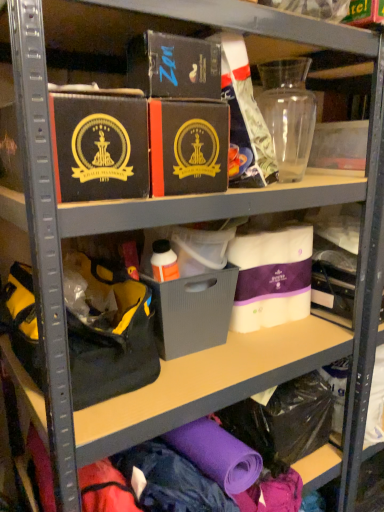
Measure the distance between white fabric quilted mattress at center, which is counted as the 4th box, starting from the left, and camera.

A distance of 3.96 feet exists between white fabric quilted mattress at center, which is counted as the 4th box, starting from the left, and camera.

What do you see at coordinates (191, 310) in the screenshot?
I see `gray matte storage box at center` at bounding box center [191, 310].

Measure the distance between point (169, 89) and camera.

76.50 centimeters.

The height and width of the screenshot is (512, 384). What are the coordinates of `matte black box at upper left, positioned as the 1th box in left-to-right order` in the screenshot? It's located at (99, 146).

From a real-world perspective, is gray matte storage box at center positioned above or below matte black box at center, the 3th box viewed from the right?

From a real-world perspective, gray matte storage box at center is physically below matte black box at center, the 3th box viewed from the right.

Is point (215, 290) closer or farther from the camera than point (171, 101)?

Point (215, 290) is positioned farther from the camera compared to point (171, 101).

How distant is gray matte storage box at center from matte black box at center, the second box in the left-to-right sequence?

gray matte storage box at center is 15.00 inches from matte black box at center, the second box in the left-to-right sequence.

Can you confirm if gray matte storage box at center is wider than matte black box at center, the 3th box viewed from the right?

Yes, gray matte storage box at center is wider than matte black box at center, the 3th box viewed from the right.

Which object is closer to the camera taking this photo, white fabric quilted mattress at center, which is counted as the 4th box, starting from the left, or matte black box at center, the 3th box viewed from the right?

matte black box at center, the 3th box viewed from the right, is closer to the camera.

Looking at this image, which is more to the left, white fabric quilted mattress at center, which is counted as the 4th box, starting from the left, or matte black box at center, the 3th box viewed from the right?

From the viewer's perspective, matte black box at center, the 3th box viewed from the right, appears more on the left side.

How different are the orientations of white fabric quilted mattress at center, the first box when ordered from right to left, and matte black box at center, the second box in the left-to-right sequence, in degrees?

The facing directions of white fabric quilted mattress at center, the first box when ordered from right to left, and matte black box at center, the second box in the left-to-right sequence, are 0.584 degrees apart.

Could you tell me if black fabric handbag at left is turned towards white fabric quilted mattress at center, which is counted as the 4th box, starting from the left?

No, black fabric handbag at left is not facing towards white fabric quilted mattress at center, which is counted as the 4th box, starting from the left.

Can you confirm if black fabric handbag at left is thinner than white fabric quilted mattress at center, the first box when ordered from right to left?

In fact, black fabric handbag at left might be wider than white fabric quilted mattress at center, the first box when ordered from right to left.

Is the surface of black fabric handbag at left in direct contact with white fabric quilted mattress at center, the first box when ordered from right to left?

No, black fabric handbag at left is not touching white fabric quilted mattress at center, the first box when ordered from right to left.

Is point (27, 369) positioned behind point (260, 247)?

No, (27, 369) is in front of (260, 247).

Can we say matte black box at upper left, which ranks as the fourth box in right-to-left order, lies outside matte black box at center, the second box in the left-to-right sequence?

Absolutely, matte black box at upper left, which ranks as the fourth box in right-to-left order, is external to matte black box at center, the second box in the left-to-right sequence.

Which is in front, matte black box at upper left, positioned as the 1th box in left-to-right order, or matte black box at center, the 3th box viewed from the right?

matte black box at upper left, positioned as the 1th box in left-to-right order, is in front.

Between matte black box at upper left, positioned as the 1th box in left-to-right order, and matte black box at center, the 3th box viewed from the right, which one has larger size?

matte black box at upper left, positioned as the 1th box in left-to-right order.

Which of these two, matte black box at upper center, which is the second box from right to left, or white fabric quilted mattress at center, the first box when ordered from right to left, is wider?

Wider between the two is matte black box at upper center, which is the second box from right to left.

Can you confirm if matte black box at upper center, which is the second box from right to left, is taller than white fabric quilted mattress at center, the first box when ordered from right to left?

No.

How many degrees apart are the facing directions of matte black box at upper center, which is counted as the third box, starting from the left, and white fabric quilted mattress at center, which is counted as the 4th box, starting from the left?

matte black box at upper center, which is counted as the third box, starting from the left, and white fabric quilted mattress at center, which is counted as the 4th box, starting from the left, are facing 0.0541 degrees away from each other.

Would you say matte black box at upper center, which is the second box from right to left, is inside or outside white fabric quilted mattress at center, the first box when ordered from right to left?

matte black box at upper center, which is the second box from right to left, is not enclosed by white fabric quilted mattress at center, the first box when ordered from right to left.

Is matte black box at center, the second box in the left-to-right sequence, not inside gray matte storage box at center?

Yes.

Considering the points (171, 149) and (183, 351), which point is in front, point (171, 149) or point (183, 351)?

Point (171, 149)

From the image's perspective, is matte black box at center, the 3th box viewed from the right, above or below gray matte storage box at center?

Based on their image positions, matte black box at center, the 3th box viewed from the right, is located above gray matte storage box at center.

Consider the image. Is white fabric quilted mattress at center, the first box when ordered from right to left, looking in the opposite direction of black fabric handbag at left?

No, white fabric quilted mattress at center, the first box when ordered from right to left,'s orientation is not away from black fabric handbag at left.

Is white fabric quilted mattress at center, which is counted as the 4th box, starting from the left, to the left of black fabric handbag at left from the viewer's perspective?

In fact, white fabric quilted mattress at center, which is counted as the 4th box, starting from the left, is to the right of black fabric handbag at left.

How different are the orientations of white fabric quilted mattress at center, which is counted as the 4th box, starting from the left, and black fabric handbag at left in degrees?

The angle between the facing direction of white fabric quilted mattress at center, which is counted as the 4th box, starting from the left, and the facing direction of black fabric handbag at left is 0.231 degrees.

Can you confirm if white fabric quilted mattress at center, which is counted as the 4th box, starting from the left, is shorter than black fabric handbag at left?

In fact, white fabric quilted mattress at center, which is counted as the 4th box, starting from the left, may be taller than black fabric handbag at left.

Find the location of `storage box that appears below the matte black box at center, the second box in the left-to-right sequence (from a real-world perspective)`. storage box that appears below the matte black box at center, the second box in the left-to-right sequence (from a real-world perspective) is located at coordinates click(x=191, y=310).

What are the coordinates of `box that is below the matte black box at center, the 3th box viewed from the right (from the image's perspective)` in the screenshot? It's located at (271, 277).

Which object lies further to the anchor point gray matte storage box at center, matte black box at upper left, positioned as the 1th box in left-to-right order, or black fabric handbag at left?

matte black box at upper left, positioned as the 1th box in left-to-right order, lies further to gray matte storage box at center than the other object.

Considering their positions, is white fabric quilted mattress at center, which is counted as the 4th box, starting from the left, positioned closer to matte black box at center, the second box in the left-to-right sequence, than matte black box at upper left, which ranks as the fourth box in right-to-left order?

matte black box at upper left, which ranks as the fourth box in right-to-left order, lies closer to matte black box at center, the second box in the left-to-right sequence, than the other object.

Estimate the real-world distances between objects in this image. Which object is closer to matte black box at upper left, positioned as the 1th box in left-to-right order, matte black box at upper center, which is counted as the third box, starting from the left, or black fabric handbag at left?

matte black box at upper center, which is counted as the third box, starting from the left.

From the image, which object appears to be nearer to matte black box at upper center, which is counted as the third box, starting from the left, white fabric quilted mattress at center, which is counted as the 4th box, starting from the left, or matte black box at upper left, positioned as the 1th box in left-to-right order?

Among the two, matte black box at upper left, positioned as the 1th box in left-to-right order, is located nearer to matte black box at upper center, which is counted as the third box, starting from the left.

From the image, which object appears to be farther from matte black box at center, the second box in the left-to-right sequence, black fabric handbag at left or gray matte storage box at center?

The object further to matte black box at center, the second box in the left-to-right sequence, is black fabric handbag at left.

Looking at the image, which one is located closer to matte black box at upper left, positioned as the 1th box in left-to-right order, matte black box at center, the 3th box viewed from the right, or matte black box at upper center, which is the second box from right to left?

matte black box at center, the 3th box viewed from the right.

Considering their positions, is matte black box at upper center, which is the second box from right to left, positioned further to gray matte storage box at center than matte black box at upper left, positioned as the 1th box in left-to-right order?

matte black box at upper center, which is the second box from right to left, is further to gray matte storage box at center.

Considering their positions, is white fabric quilted mattress at center, which is counted as the 4th box, starting from the left, positioned further to matte black box at upper left, positioned as the 1th box in left-to-right order, than matte black box at center, the 3th box viewed from the right?

white fabric quilted mattress at center, which is counted as the 4th box, starting from the left, is positioned further to the anchor matte black box at upper left, positioned as the 1th box in left-to-right order.

What are the coordinates of `storage box between matte black box at upper left, positioned as the 1th box in left-to-right order, and white fabric quilted mattress at center, the first box when ordered from right to left, from left to right` in the screenshot? It's located at click(191, 310).

You are a GUI agent. You are given a task and a screenshot of the screen. Output one action in this format:
    pyautogui.click(x=<x>, y=<y>)
    Task: Click on the storage box between matte black box at center, the second box in the left-to-right sequence, and black fabric handbag at left vertically
    This screenshot has width=384, height=512.
    Given the screenshot: What is the action you would take?
    (x=191, y=310)

I want to click on box between matte black box at upper left, positioned as the 1th box in left-to-right order, and matte black box at upper center, which is counted as the third box, starting from the left, so click(x=188, y=146).

Locate an element on the screen. The width and height of the screenshot is (384, 512). storage box located between black fabric handbag at left and white fabric quilted mattress at center, which is counted as the 4th box, starting from the left, in the left-right direction is located at coordinates (191, 310).